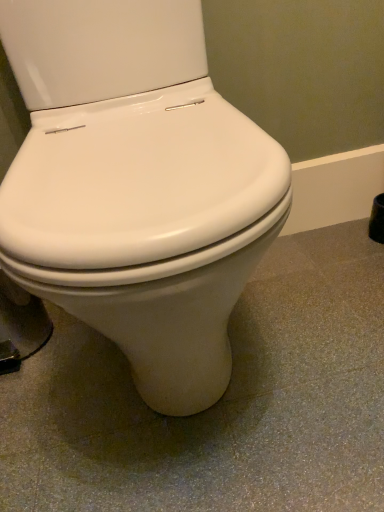
You are a GUI agent. You are given a task and a screenshot of the screen. Output one action in this format:
    pyautogui.click(x=<x>, y=<y>)
    Task: Click on the white glossy toilet at center
    
    Given the screenshot: What is the action you would take?
    pyautogui.click(x=137, y=187)

What do you see at coordinates (137, 187) in the screenshot? I see `white glossy toilet at center` at bounding box center [137, 187].

Measure the distance between point (x=128, y=288) and camera.

Point (x=128, y=288) is 15.24 inches from camera.

Find the location of `white glossy toilet at center`. white glossy toilet at center is located at coordinates 137,187.